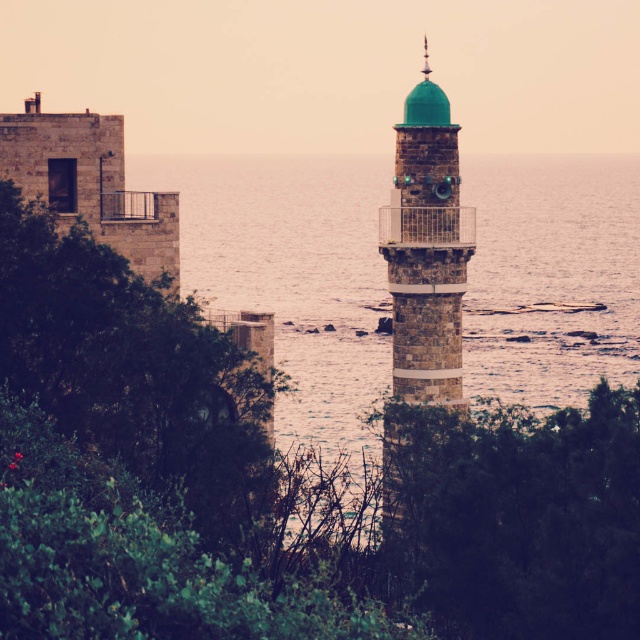
You are standing at the center of the coastal scene and want to walk towards the two points marked in the image. Which point, point (264, 492) or point (440, 364), will you reach first?

Point (264, 492) is in front of point (440, 364), so you will reach point (264, 492) first.